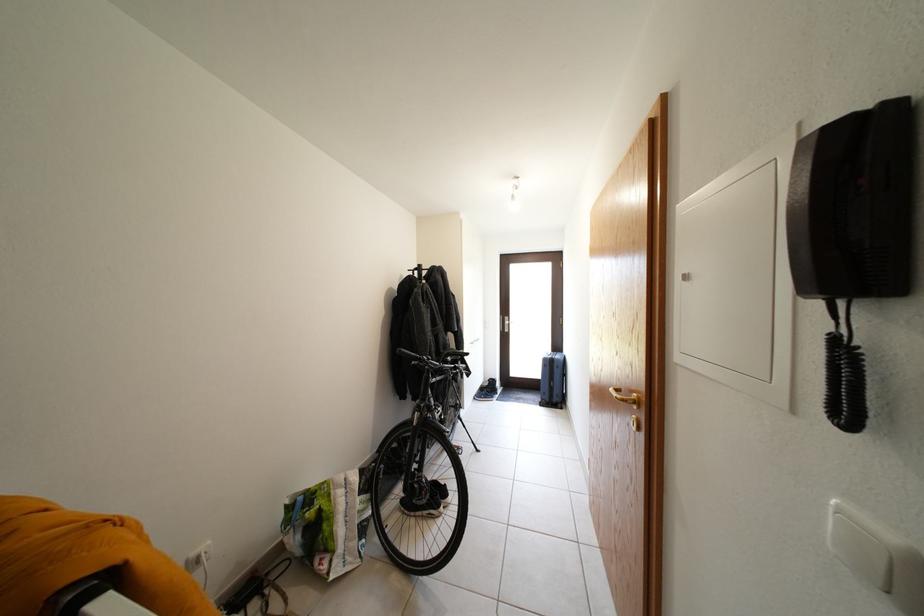
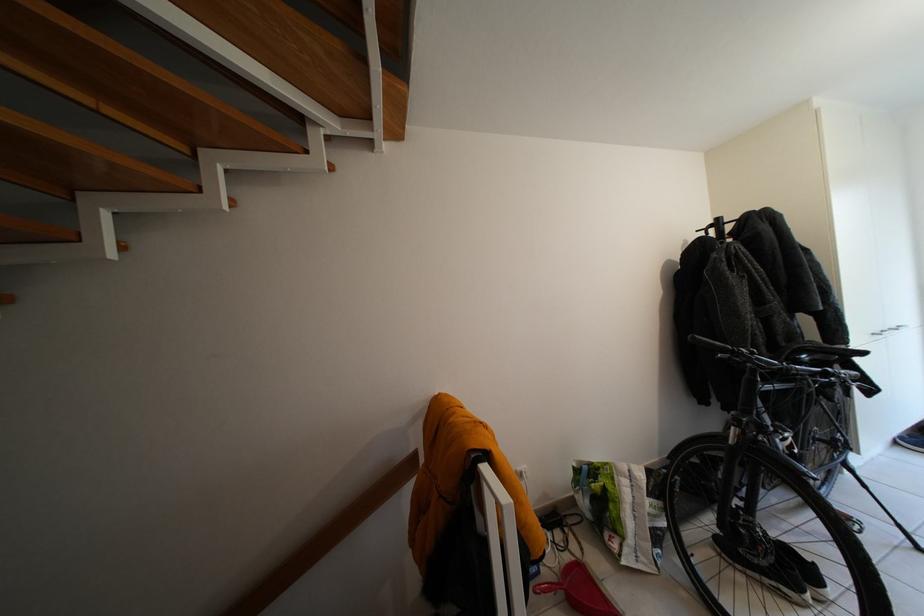
Find the pixel in the second image that matches point 412,358 in the first image.

(710, 345)